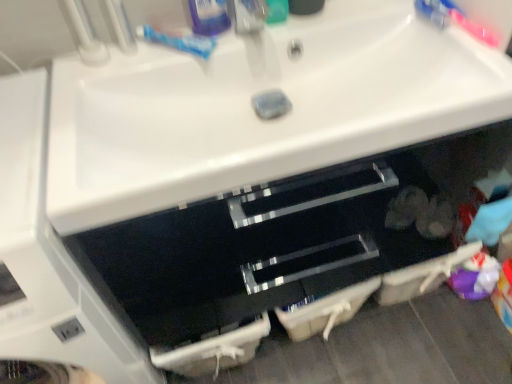
Image resolution: width=512 pixels, height=384 pixels. Find the location of `vacant area that lies to the right of matte plastic faucet at upper center`. vacant area that lies to the right of matte plastic faucet at upper center is located at coordinates (335, 23).